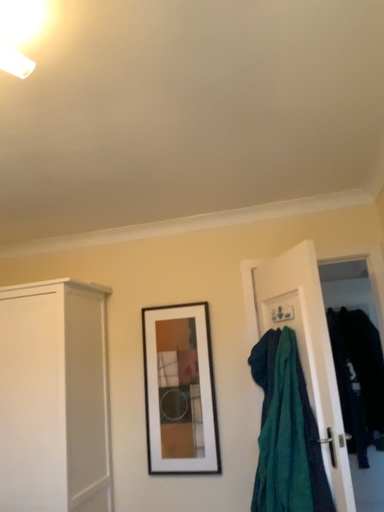
The width and height of the screenshot is (384, 512). Describe the element at coordinates (304, 345) in the screenshot. I see `teal fabric at right` at that location.

Measure the distance between point (152, 332) and camera.

The depth of point (152, 332) is 9.83 feet.

What do you see at coordinates (180, 390) in the screenshot? This screenshot has width=384, height=512. I see `wooden framed artwork at center` at bounding box center [180, 390].

Where is `dark blue fabric at right`? This screenshot has height=512, width=384. dark blue fabric at right is located at coordinates (358, 378).

From the image's perspective, is dark blue fabric at right positioned above or below white matte cabinet at left?

From the image's perspective, dark blue fabric at right appears below white matte cabinet at left.

Is dark blue fabric at right next to white matte cabinet at left and touching it?

They are not placed beside each other.

The height and width of the screenshot is (512, 384). I want to click on cabinetry in front of the dark blue fabric at right, so [54, 398].

From the picture: Does dark blue fabric at right have a lesser height compared to teal fabric at right?

Yes.

Which of these two, dark blue fabric at right or teal fabric at right, is wider?

Wider between the two is dark blue fabric at right.

Does dark blue fabric at right have a smaller size compared to teal fabric at right?

Actually, dark blue fabric at right might be larger than teal fabric at right.

Considering the positions of objects white matte cabinet at left and teal fabric at right in the image provided, who is more to the right, white matte cabinet at left or teal fabric at right?

teal fabric at right.

How many degrees apart are the facing directions of white matte cabinet at left and teal fabric at right?

The facing directions of white matte cabinet at left and teal fabric at right are 69.6 degrees apart.

Considering the relative sizes of white matte cabinet at left and teal fabric at right in the image provided, is white matte cabinet at left wider than teal fabric at right?

Indeed, white matte cabinet at left has a greater width compared to teal fabric at right.

Is white matte cabinet at left located outside teal fabric at right?

That's correct, white matte cabinet at left is outside of teal fabric at right.

Is wooden framed artwork at center positioned with its back to teal fabric at right?

No, wooden framed artwork at center's orientation is not away from teal fabric at right.

From the image's perspective, which one is positioned higher, wooden framed artwork at center or teal fabric at right?

teal fabric at right, from the image's perspective.

Considering the sizes of objects wooden framed artwork at center and teal fabric at right in the image provided, who is shorter, wooden framed artwork at center or teal fabric at right?

wooden framed artwork at center is shorter.

Is white matte cabinet at left spatially inside dark blue fabric at right, or outside of it?

white matte cabinet at left is spatially situated outside dark blue fabric at right.

Is white matte cabinet at left shorter than dark blue fabric at right?

In fact, white matte cabinet at left may be taller than dark blue fabric at right.

From the picture: How different are the orientations of white matte cabinet at left and dark blue fabric at right in degrees?

They differ by 5.4 degrees in their facing directions.

Measure the distance between white matte cabinet at left and dark blue fabric at right.

They are 2.03 meters apart.

How much distance is there between teal fabric at right and wooden framed artwork at center?

25.80 inches.

Looking at the image, does teal fabric at right seem bigger or smaller compared to wooden framed artwork at center?

In the image, teal fabric at right appears to be larger than wooden framed artwork at center.

Is teal fabric at right facing away from wooden framed artwork at center?

That's not correct — teal fabric at right is not looking away from wooden framed artwork at center.

What's the angular difference between teal fabric at right and wooden framed artwork at center's facing directions?

They differ by 69.3 degrees in their facing directions.

Can you see teal fabric at right touching white matte cabinet at left?

They are not placed beside each other.

Looking at the image, does teal fabric at right seem bigger or smaller compared to white matte cabinet at left?

Clearly, teal fabric at right is smaller in size than white matte cabinet at left.

How many degrees apart are the facing directions of teal fabric at right and white matte cabinet at left?

69.6 degrees separate the facing orientations of teal fabric at right and white matte cabinet at left.

The height and width of the screenshot is (512, 384). Find the location of `cabinetry positioned vertically above the dark blue fabric at right (from a real-world perspective)`. cabinetry positioned vertically above the dark blue fabric at right (from a real-world perspective) is located at coordinates (54, 398).

Where is `door in front of the dark blue fabric at right`? The image size is (384, 512). door in front of the dark blue fabric at right is located at coordinates (304, 345).

Estimate the real-world distances between objects in this image. Which object is further from wooden framed artwork at center, dark blue fabric at right or teal fabric at right?

The object further to wooden framed artwork at center is dark blue fabric at right.

Based on their spatial positions, is wooden framed artwork at center or dark blue fabric at right further from white matte cabinet at left?

Based on the image, dark blue fabric at right appears to be further to white matte cabinet at left.

When comparing their distances from wooden framed artwork at center, does white matte cabinet at left or teal fabric at right seem further?

teal fabric at right lies further to wooden framed artwork at center than the other object.

Which object lies nearer to the anchor point teal fabric at right, wooden framed artwork at center or white matte cabinet at left?

The object closer to teal fabric at right is wooden framed artwork at center.

From the image, which object appears to be nearer to teal fabric at right, dark blue fabric at right or white matte cabinet at left?

Among the two, dark blue fabric at right is located nearer to teal fabric at right.

Which object lies nearer to the anchor point white matte cabinet at left, wooden framed artwork at center or teal fabric at right?

wooden framed artwork at center is closer to white matte cabinet at left.

Considering their positions, is dark blue fabric at right positioned closer to white matte cabinet at left than teal fabric at right?

teal fabric at right lies closer to white matte cabinet at left than the other object.

When comparing their distances from white matte cabinet at left, does teal fabric at right or dark blue fabric at right seem closer?

The object closer to white matte cabinet at left is teal fabric at right.

I want to click on door between wooden framed artwork at center and dark blue fabric at right from left to right, so click(x=304, y=345).

Identify the location of picture frame between white matte cabinet at left and teal fabric at right. (180, 390).

Where is `picture frame situated between white matte cabinet at left and dark blue fabric at right from left to right`? Image resolution: width=384 pixels, height=512 pixels. picture frame situated between white matte cabinet at left and dark blue fabric at right from left to right is located at coordinates (180, 390).

This screenshot has height=512, width=384. Identify the location of door between white matte cabinet at left and dark blue fabric at right from left to right. click(x=304, y=345).